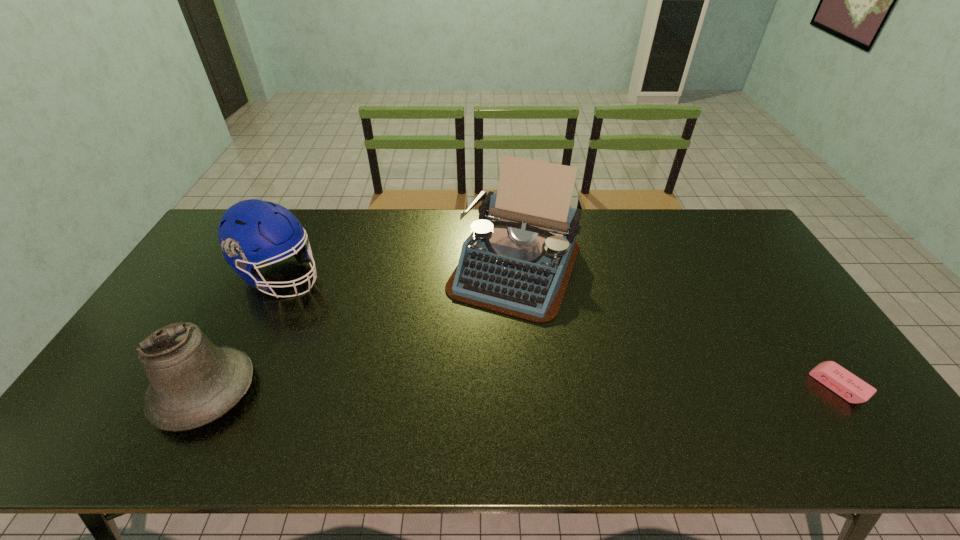
The width and height of the screenshot is (960, 540). Identify the location of bell. (193, 382).

Where is `the rightmost object`? The height and width of the screenshot is (540, 960). the rightmost object is located at coordinates (845, 384).

You are a GUI agent. You are given a task and a screenshot of the screen. Output one action in this format:
    pyautogui.click(x=<x>, y=<y>)
    Task: Click on the shortest object
    
    Given the screenshot: What is the action you would take?
    [x=845, y=384]

Identify the location of football helmet. (249, 225).

The height and width of the screenshot is (540, 960). Identify the location of typewriter. (x=518, y=260).

This screenshot has width=960, height=540. I want to click on vacant point located 0.120m on the back of the bell, so click(x=243, y=319).

Image resolution: width=960 pixels, height=540 pixels. I want to click on vacant space situated 0.340m on the back of the shortest object, so click(762, 277).

Locate an element on the screen. The height and width of the screenshot is (540, 960). vacant area situated 0.130m on the front-facing side of the football helmet is located at coordinates (343, 306).

Identify the location of vacant space located on the front-facing side of the football helmet. (336, 301).

Image resolution: width=960 pixels, height=540 pixels. In order to click on vacant position located 0.240m on the front-facing side of the football helmet in this screenshot , I will do `click(370, 321)`.